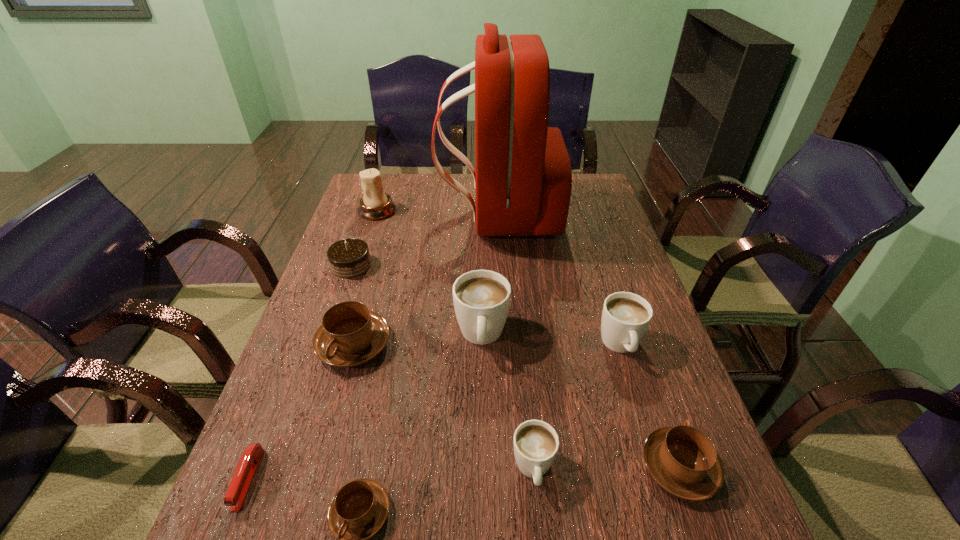
At what (x,y) coordinates should I click in order to perform the action: click on the rightmost brown cappuccino. Please return your answer as a coordinate pair (x, y). This screenshot has width=960, height=540. Looking at the image, I should click on (682, 460).

The height and width of the screenshot is (540, 960). Find the location of `the shortest object`. the shortest object is located at coordinates (239, 487).

What are the coordinates of `red stapler` in the screenshot? It's located at (x=239, y=487).

Locate an element on the screen. free space located on the strap side of the pink backpack is located at coordinates (358, 215).

Identify the location of free space located 0.090m on the strap side of the pink backpack. This screenshot has width=960, height=540. (414, 215).

Image resolution: width=960 pixels, height=540 pixels. In order to click on vacant space located on the strap side of the pink backpack in this screenshot , I will do [x=405, y=215].

Identify the location of vacant point located 0.150m on the back of the white candle holder. This screenshot has height=540, width=960. (387, 180).

Locate an element on the screen. The width and height of the screenshot is (960, 540). free space located 0.180m with the handle on the side of the eighth shortest object is located at coordinates [x=482, y=436].

Locate an element on the screen. The height and width of the screenshot is (540, 960). vacant space located 0.160m with the handle on the side of the fifth shortest cappuccino is located at coordinates (648, 433).

The width and height of the screenshot is (960, 540). Identify the location of free region located on the right of the chocolate cake. (448, 265).